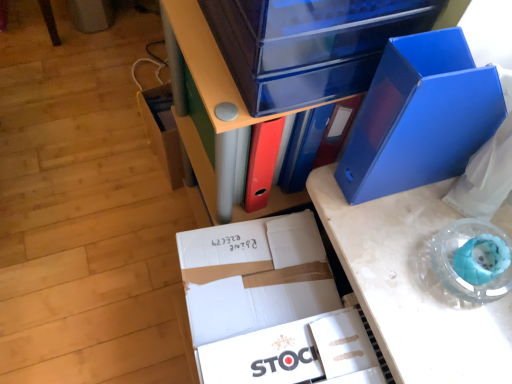
Measure the distance between matte blue file at center and camera.

matte blue file at center and camera are 21.06 inches apart from each other.

Locate an element on the screen. matte blue file at center is located at coordinates (221, 106).

Where is `transparent plastic storage box at upper center, which is the first storage box in front-to-back order`? The height and width of the screenshot is (384, 512). transparent plastic storage box at upper center, which is the first storage box in front-to-back order is located at coordinates (309, 45).

This screenshot has height=384, width=512. What do you see at coordinates (309, 45) in the screenshot? I see `transparent plastic storage box at upper center, which is counted as the first storage box, starting from the right` at bounding box center [309, 45].

Describe the element at coordinates (268, 304) in the screenshot. The image size is (512, 384). I see `white cardboard box at center` at that location.

Find the location of a particular element. The image size is (512, 384). matte blue file at center is located at coordinates (221, 106).

Considering the sizes of objects white cardboard box at center and matte blue file at center in the image provided, who is bigger, white cardboard box at center or matte blue file at center?

matte blue file at center is bigger.

Considering the sizes of white cardboard box at center and matte blue file at center in the image, is white cardboard box at center wider or thinner than matte blue file at center?

In the image, white cardboard box at center appears to be more narrow than matte blue file at center.

Is white cardboard box at center located outside matte blue file at center?

white cardboard box at center is positioned outside matte blue file at center.

Considering their positions, is white cardboard box at center located in front of or behind matte blue file at center?

In the image, white cardboard box at center appears behind matte blue file at center.

Is matte plastic storage box at lower left, acting as the 1th storage box starting from the left, inside or outside of transparent plastic storage box at upper center, arranged as the second storage box when viewed from the left?

matte plastic storage box at lower left, acting as the 1th storage box starting from the left, is outside transparent plastic storage box at upper center, arranged as the second storage box when viewed from the left.

From a real-world perspective, who is located higher, matte plastic storage box at lower left, which appears as the 1th storage box when viewed from the back, or transparent plastic storage box at upper center, arranged as the second storage box when viewed from the back?

From a 3D spatial view, transparent plastic storage box at upper center, arranged as the second storage box when viewed from the back, is above.

Locate an element on the screen. This screenshot has width=512, height=384. storage box lying in front of the matte plastic storage box at lower left, the second storage box when ordered from right to left is located at coordinates (309, 45).

Consider the image. Are blue plastic desk at center and matte plastic storage box at lower left, acting as the 1th storage box starting from the left, far apart?

blue plastic desk at center is actually quite close to matte plastic storage box at lower left, acting as the 1th storage box starting from the left.

Is matte plastic storage box at lower left, acting as the 1th storage box starting from the left, located within blue plastic desk at center?

Actually, matte plastic storage box at lower left, acting as the 1th storage box starting from the left, is outside blue plastic desk at center.

Could you tell me if blue plastic desk at center is turned towards matte plastic storage box at lower left, acting as the 1th storage box starting from the left?

No, blue plastic desk at center does not turn towards matte plastic storage box at lower left, acting as the 1th storage box starting from the left.

From a real-world perspective, between blue plastic desk at center and matte plastic storage box at lower left, acting as the 1th storage box starting from the left, who is vertically higher?

blue plastic desk at center.

Is white cardboard stock at center, which is counted as the 2th paperback book, starting from the top, touching transparent plastic storage box at upper center, which is counted as the first storage box, starting from the right?

There is a gap between white cardboard stock at center, which is counted as the 2th paperback book, starting from the top, and transparent plastic storage box at upper center, which is counted as the first storage box, starting from the right.

Between white cardboard stock at center, acting as the second paperback book starting from the right, and transparent plastic storage box at upper center, which is the first storage box in front-to-back order, which one is positioned in front?

transparent plastic storage box at upper center, which is the first storage box in front-to-back order, is in front.

Is white cardboard stock at center, the 1th paperback book from the bottom, wider or thinner than transparent plastic storage box at upper center, arranged as the second storage box when viewed from the back?

In the image, white cardboard stock at center, the 1th paperback book from the bottom, appears to be more narrow than transparent plastic storage box at upper center, arranged as the second storage box when viewed from the back.

Are blue plastic folder at upper right, positioned as the first paperback book in right-to-left order, and matte plastic storage box at lower left, which appears as the 1th storage box when viewed from the back, making contact?

blue plastic folder at upper right, positioned as the first paperback book in right-to-left order, and matte plastic storage box at lower left, which appears as the 1th storage box when viewed from the back, are clearly separated.

Is the depth of blue plastic folder at upper right, arranged as the first paperback book when viewed from the top, greater than that of matte plastic storage box at lower left, the second storage box when ordered from right to left?

No, it is not.

From the image's perspective, is blue plastic folder at upper right, the second paperback book ordered from the bottom, on matte plastic storage box at lower left, the second storage box when ordered from right to left?

Actually, blue plastic folder at upper right, the second paperback book ordered from the bottom, appears below matte plastic storage box at lower left, the second storage box when ordered from right to left, in the image.

Is blue plastic folder at upper right, positioned as the 2th paperback book in left-to-right order, facing away from matte plastic storage box at lower left, the 2th storage box positioned from the front?

No, blue plastic folder at upper right, positioned as the 2th paperback book in left-to-right order, is not facing away from matte plastic storage box at lower left, the 2th storage box positioned from the front.

Find the location of a particular element. desk below the blue plastic folder at upper right, positioned as the 2th paperback book in left-to-right order (from the image's perspective) is located at coordinates (413, 286).

Would you say blue plastic folder at upper right, the second paperback book ordered from the bottom, contains blue plastic desk at center?

Actually, blue plastic desk at center is outside blue plastic folder at upper right, the second paperback book ordered from the bottom.

From a real-world perspective, is blue plastic folder at upper right, arranged as the first paperback book when viewed from the top, above or below blue plastic desk at center?

blue plastic folder at upper right, arranged as the first paperback book when viewed from the top, is above blue plastic desk at center.

Are blue plastic folder at upper right, positioned as the 2th paperback book in left-to-right order, and blue plastic desk at center located far from each other?

No, there isn't a large distance between blue plastic folder at upper right, positioned as the 2th paperback book in left-to-right order, and blue plastic desk at center.

Looking at this image, considering the sizes of objects matte blue file at center and transparent plastic storage box at upper center, arranged as the second storage box when viewed from the back, in the image provided, who is thinner, matte blue file at center or transparent plastic storage box at upper center, arranged as the second storage box when viewed from the back,?

transparent plastic storage box at upper center, arranged as the second storage box when viewed from the back, is thinner.

Is transparent plastic storage box at upper center, which is the first storage box in front-to-back order, at the back of matte blue file at center?

No, matte blue file at center is not facing the opposite direction of transparent plastic storage box at upper center, which is the first storage box in front-to-back order.

Is matte blue file at center far from transparent plastic storage box at upper center, arranged as the second storage box when viewed from the left?

matte blue file at center is actually quite close to transparent plastic storage box at upper center, arranged as the second storage box when viewed from the left.

This screenshot has width=512, height=384. Identify the location of furniture that is in front of the white cardboard box at center. (221, 106).

Locate an element on the screen. storage box that is under the transparent plastic storage box at upper center, which is the first storage box in front-to-back order (from a real-world perspective) is located at coordinates (162, 130).

From the picture: From the image, which object appears to be nearer to white cardboard box at center, blue plastic desk at center or matte blue file at center?

Based on the image, blue plastic desk at center appears to be nearer to white cardboard box at center.

When comparing their distances from blue plastic folder at upper right, positioned as the 2th paperback book in left-to-right order, does matte blue file at center or matte plastic storage box at lower left, the second storage box when ordered from right to left, seem closer?

Among the two, matte blue file at center is located nearer to blue plastic folder at upper right, positioned as the 2th paperback book in left-to-right order.

Estimate the real-world distances between objects in this image. Which object is closer to blue plastic desk at center, white cardboard box at center or blue plastic folder at upper right, positioned as the first paperback book in right-to-left order?

white cardboard box at center.

Based on their spatial positions, is white cardboard box at center or white cardboard stock at center, positioned as the first paperback book in left-to-right order, further from blue plastic folder at upper right, positioned as the first paperback book in right-to-left order?

white cardboard stock at center, positioned as the first paperback book in left-to-right order, is further to blue plastic folder at upper right, positioned as the first paperback book in right-to-left order.

Estimate the real-world distances between objects in this image. Which object is closer to matte plastic storage box at lower left, acting as the 1th storage box starting from the left, white cardboard stock at center, positioned as the first paperback book in left-to-right order, or blue plastic folder at upper right, positioned as the 2th paperback book in left-to-right order?

blue plastic folder at upper right, positioned as the 2th paperback book in left-to-right order.

Considering their positions, is matte plastic storage box at lower left, the 2th storage box positioned from the front, positioned closer to white cardboard stock at center, positioned as the first paperback book in left-to-right order, than transparent plastic storage box at upper center, which is the first storage box in front-to-back order?

Based on the image, transparent plastic storage box at upper center, which is the first storage box in front-to-back order, appears to be nearer to white cardboard stock at center, positioned as the first paperback book in left-to-right order.

From the image, which object appears to be nearer to matte blue file at center, white cardboard box at center or blue plastic folder at upper right, arranged as the first paperback book when viewed from the top?

Based on the image, blue plastic folder at upper right, arranged as the first paperback book when viewed from the top, appears to be nearer to matte blue file at center.

Looking at the image, which one is located closer to blue plastic folder at upper right, the second paperback book ordered from the bottom, white cardboard stock at center, positioned as the first paperback book in left-to-right order, or matte blue file at center?

Among the two, matte blue file at center is located nearer to blue plastic folder at upper right, the second paperback book ordered from the bottom.

Find the location of a particular element. This screenshot has width=512, height=384. paperback book between matte blue file at center and matte plastic storage box at lower left, acting as the 1th storage box starting from the left, along the z-axis is located at coordinates (292, 352).

Where is `box between blue plastic folder at upper right, positioned as the 2th paperback book in left-to-right order, and white cardboard stock at center, positioned as the first paperback book in left-to-right order, vertically`? This screenshot has height=384, width=512. box between blue plastic folder at upper right, positioned as the 2th paperback book in left-to-right order, and white cardboard stock at center, positioned as the first paperback book in left-to-right order, vertically is located at coordinates (268, 304).

Locate an element on the screen. The width and height of the screenshot is (512, 384). paperback book between transparent plastic storage box at upper center, arranged as the second storage box when viewed from the back, and white cardboard stock at center, acting as the second paperback book starting from the right, vertically is located at coordinates (420, 117).

Find the location of a particular element. desk between matte blue file at center and matte plastic storage box at lower left, which appears as the 1th storage box when viewed from the back, along the z-axis is located at coordinates (413, 286).